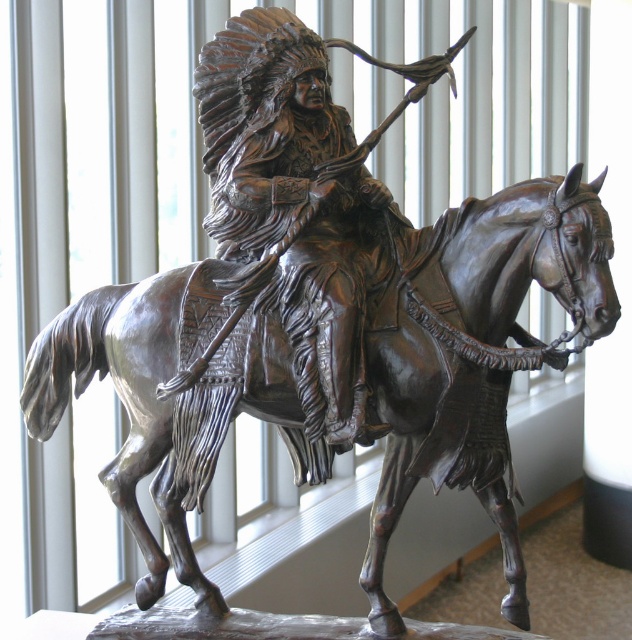
Who is taller, bronze horse at center or bronze statue at center?

A: With more height is bronze horse at center.

Does point (392, 348) come in front of point (377, 228)?

That is True.

The width and height of the screenshot is (632, 640). What do you see at coordinates (477, 353) in the screenshot?
I see `bronze horse at center` at bounding box center [477, 353].

Find the location of a particular element. This screenshot has width=632, height=640. bronze horse at center is located at coordinates (477, 353).